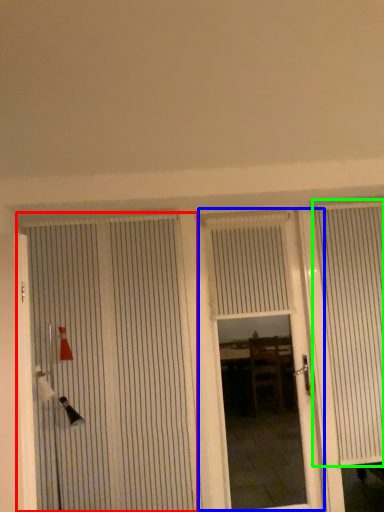
Question: Estimate the real-world distances between objects in this image. Which object is closer to door (highlighted by a red box), door (highlighted by a blue box) or curtain (highlighted by a green box)?

Choices:
 (A) door
 (B) curtain

Answer: (B)